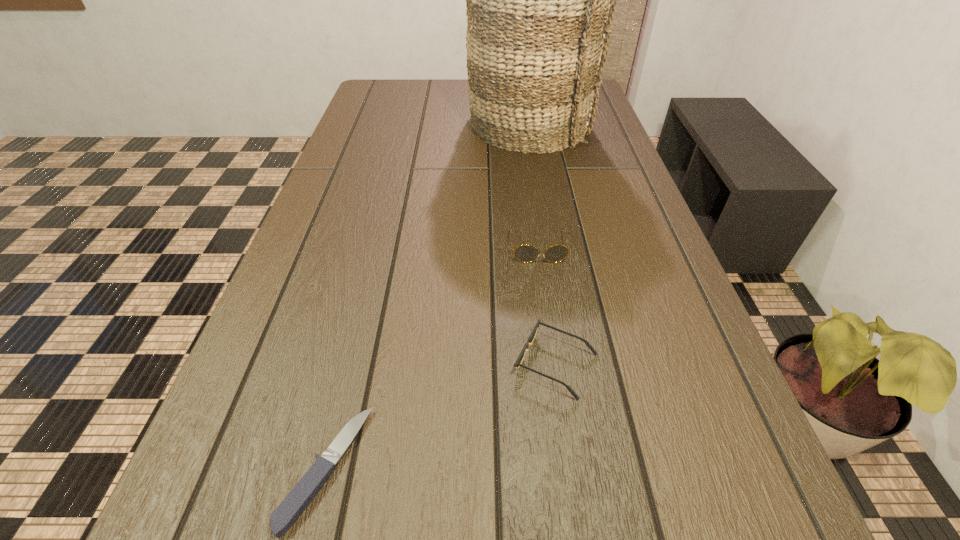
This screenshot has width=960, height=540. In order to click on free spot between the farther sunglasses and the third tallest object in this screenshot , I will do `click(547, 306)`.

Where is `vacant space that's between the nearer sunglasses and the shortest object`? The width and height of the screenshot is (960, 540). vacant space that's between the nearer sunglasses and the shortest object is located at coordinates point(441,416).

Identify which object is located as the second nearest to the nearest object. Please provide its 2D coordinates. Your answer should be formatted as a tuple, i.e. [(x, y)], where the tuple contains the x and y coordinates of a point satisfying the conditions above.

[(525, 253)]

The width and height of the screenshot is (960, 540). I want to click on object identified as the third closest to the farther sunglasses, so click(x=299, y=498).